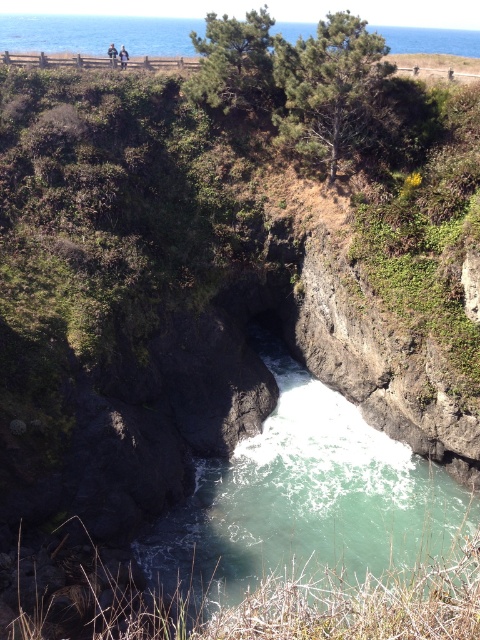
Question: Is green mossy rock at upper center below light brown wooden bench at upper center?

Choices:
 (A) yes
 (B) no

Answer: (A)

Question: Can you confirm if green mossy rock at upper center is wider than light brown wooden bench at upper center?

Choices:
 (A) no
 (B) yes

Answer: (B)

Question: Which point is closer to the camera?

Choices:
 (A) green mossy rock at upper center
 (B) light brown wooden bench at upper center
 (C) blurred human figure at upper center

Answer: (A)

Question: Which of the following is the closest to the observer?

Choices:
 (A) green rock river at upper center
 (B) green mossy rock at upper center
 (C) light brown wooden bench at upper center

Answer: (B)

Question: Estimate the real-world distances between objects in this image. Which object is closer to the blurred human figure at upper center?

Choices:
 (A) green rock river at upper center
 (B) light brown wooden bench at upper center

Answer: (B)

Question: In this image, where is blurred human figure at upper center located relative to light brown wooden bench at upper center?

Choices:
 (A) left
 (B) right

Answer: (A)